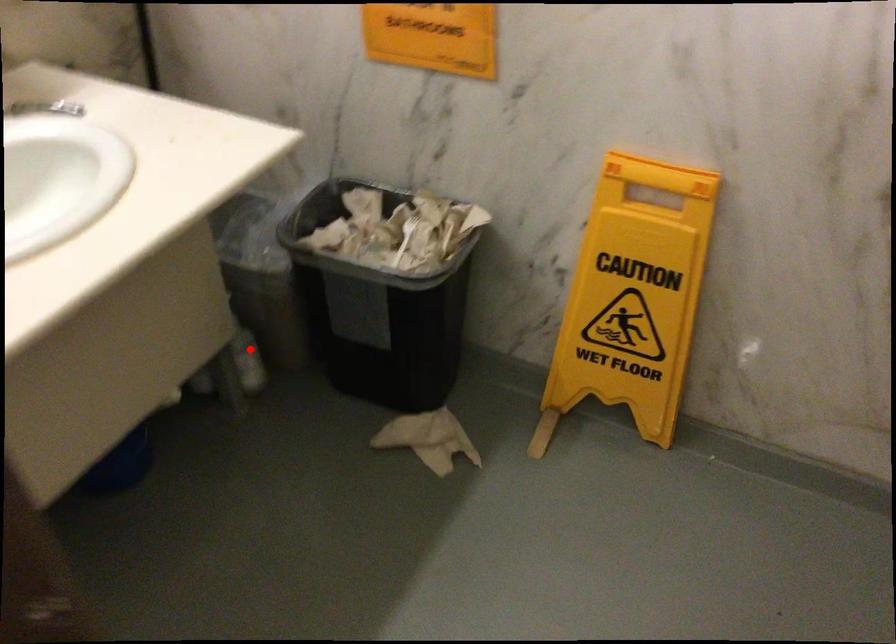
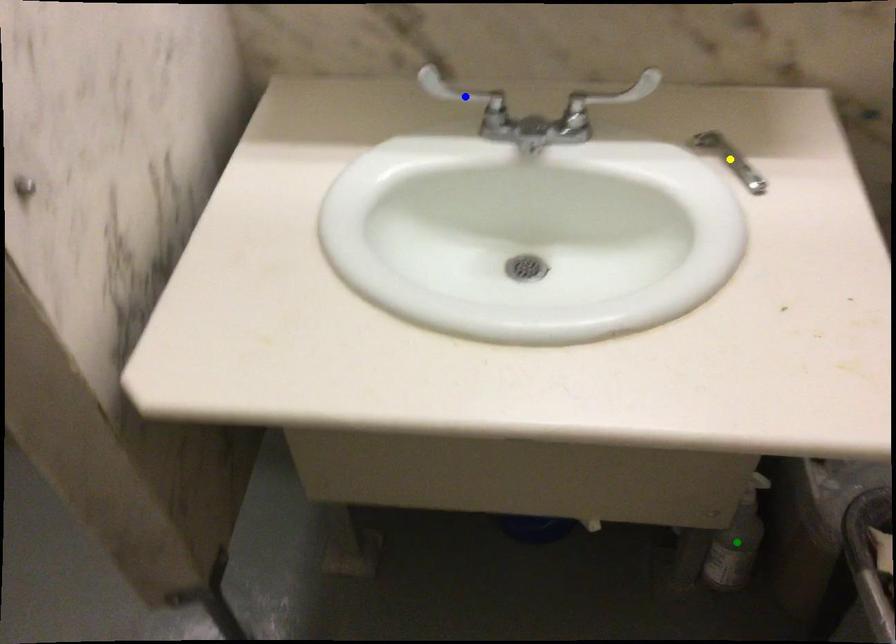
Question: I am providing you with two images of the same scene from different viewpoints. A red point is marked on the first image. You are given multiple points on the second image. Which mark in image 2 goes with the point in image 1?

Choices:
 (A) yellow point
 (B) blue point
 (C) green point

Answer: (C)